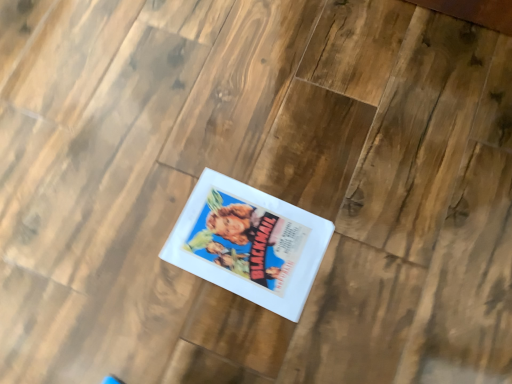
You are a GUI agent. You are given a task and a screenshot of the screen. Output one action in this format:
    pyautogui.click(x=<x>, y=<y>)
    Task: Click on the vacant area that is in front of white glossy paperback book at center
    The height and width of the screenshot is (384, 512).
    Given the screenshot: What is the action you would take?
    pyautogui.click(x=248, y=341)